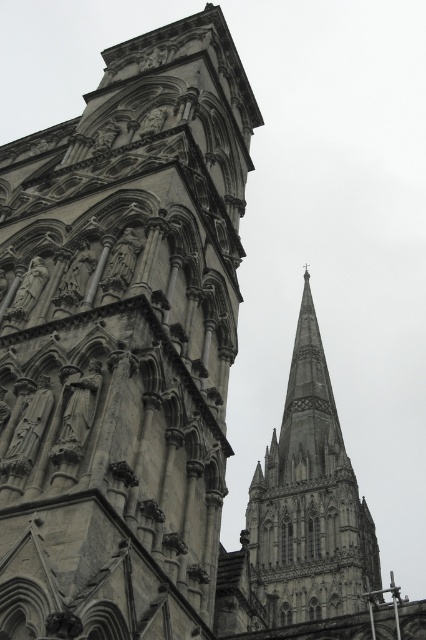
Can you confirm if stone carvings at center is positioned to the left of gray stone spire at upper center?

Yes, stone carvings at center is to the left of gray stone spire at upper center.

Can you confirm if stone carvings at center is positioned above gray stone spire at upper center?

Yes.

Where is `stone carvings at center`? The width and height of the screenshot is (426, 640). stone carvings at center is located at coordinates (123, 342).